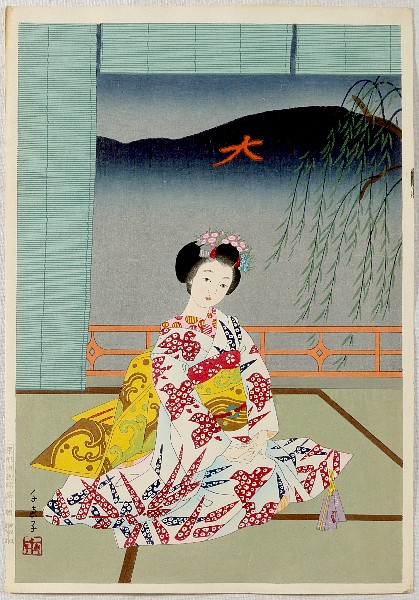
You are a GUI agent. You are given a task and a screenshot of the screen. Output one action in this format:
    pyautogui.click(x=<x>, y=<y>)
    Task: Click on the light blue blinds
    
    Given the screenshot: What is the action you would take?
    pyautogui.click(x=74, y=34), pyautogui.click(x=124, y=33), pyautogui.click(x=306, y=35)